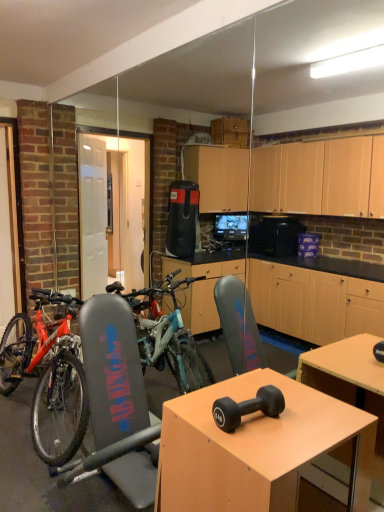
I want to click on black rubber dumbbell at center, so click(x=247, y=407).

Can you confirm if matte wood desk at center is bigger than black rubber dumbbell at center?

Indeed, matte wood desk at center has a larger size compared to black rubber dumbbell at center.

Based on the photo, from the image's perspective, is matte wood desk at center on black rubber dumbbell at center?

No.

How different are the orientations of matte wood desk at center and black rubber dumbbell at center in degrees?

The angular difference between matte wood desk at center and black rubber dumbbell at center is 1.64 degrees.

From a real-world perspective, is matte wood desk at center physically above black rubber dumbbell at center?

No, from a real-world perspective, matte wood desk at center is not above black rubber dumbbell at center.

Who is taller, shiny metallic bicycle at left or matte wood desk at center?

With more height is shiny metallic bicycle at left.

At what (x,y) coordinates should I click in order to perform the action: click on bicycle to the left of matte wood desk at center. Please return your answer as a coordinate pair (x, y). Looking at the image, I should click on (60, 405).

Consider the image. Is matte wood desk at center at the back of shiny metallic bicycle at left?

No, matte wood desk at center is not at the back of shiny metallic bicycle at left.

How different are the orientations of shiny metallic bicycle at left and matte wood desk at center in degrees?

There is a 2.19-degree angle between the facing directions of shiny metallic bicycle at left and matte wood desk at center.

Is shiny metallic bicycle at left bigger than black rubber dumbbell at center?

Yes, shiny metallic bicycle at left is bigger than black rubber dumbbell at center.

Based on the photo, from the image's perspective, between shiny metallic bicycle at left and black rubber dumbbell at center, which one is located above?

black rubber dumbbell at center, from the image's perspective.

Is shiny metallic bicycle at left wider or thinner than black rubber dumbbell at center?

shiny metallic bicycle at left is wider than black rubber dumbbell at center.

Which of these two, shiny metallic bicycle at left or black rubber dumbbell at center, stands shorter?

black rubber dumbbell at center is shorter.

Between black rubber dumbbell at center and matte wood desk at center, which one appears on the right side from the viewer's perspective?

matte wood desk at center is more to the right.

Which object is further away from the camera taking this photo, black rubber dumbbell at center or matte wood desk at center?

black rubber dumbbell at center is more distant.

Considering the relative sizes of black rubber dumbbell at center and matte wood desk at center in the image provided, is black rubber dumbbell at center thinner than matte wood desk at center?

Yes.

You are a GUI agent. You are given a task and a screenshot of the screen. Output one action in this format:
    pyautogui.click(x=<x>, y=<y>)
    Task: Click on the desk that appears above the shiny metallic bicycle at left (from a real-world perspective)
    
    Given the screenshot: What is the action you would take?
    pyautogui.click(x=256, y=448)

Does point (362, 466) appear closer or farther from the camera than point (36, 447)?

Point (362, 466) is positioned closer to the camera compared to point (36, 447).

Are matte wood desk at center and shiny metallic bicycle at left making contact?

There is a gap between matte wood desk at center and shiny metallic bicycle at left.

Looking at the image, does matte wood desk at center seem bigger or smaller compared to shiny metallic bicycle at left?

matte wood desk at center is smaller than shiny metallic bicycle at left.

Between black rubber dumbbell at center and shiny metallic bicycle at left, which one appears on the left side from the viewer's perspective?

Positioned to the left is shiny metallic bicycle at left.

Based on the photo, is black rubber dumbbell at center looking in the opposite direction of shiny metallic bicycle at left?

No, black rubber dumbbell at center is not facing away from shiny metallic bicycle at left.

Considering the relative sizes of black rubber dumbbell at center and shiny metallic bicycle at left in the image provided, is black rubber dumbbell at center shorter than shiny metallic bicycle at left?

Yes.

Where is `desk in front of the black rubber dumbbell at center`? The width and height of the screenshot is (384, 512). desk in front of the black rubber dumbbell at center is located at coordinates (256, 448).

Locate an element on the screen. The image size is (384, 512). bicycle behind the matte wood desk at center is located at coordinates (60, 405).

Looking at the image, which one is located further to black rubber dumbbell at center, matte wood desk at center or shiny metallic bicycle at left?

shiny metallic bicycle at left.

Estimate the real-world distances between objects in this image. Which object is further from matte wood desk at center, shiny metallic bicycle at left or black rubber dumbbell at center?

shiny metallic bicycle at left.

From the image, which object appears to be nearer to black rubber dumbbell at center, shiny metallic bicycle at left or matte wood desk at center?

matte wood desk at center lies closer to black rubber dumbbell at center than the other object.

Looking at the image, which one is located closer to shiny metallic bicycle at left, matte wood desk at center or black rubber dumbbell at center?

matte wood desk at center is closer to shiny metallic bicycle at left.

Looking at the image, which one is located further to matte wood desk at center, black rubber dumbbell at center or shiny metallic bicycle at left?

shiny metallic bicycle at left lies further to matte wood desk at center than the other object.

Based on their spatial positions, is black rubber dumbbell at center or matte wood desk at center further from shiny metallic bicycle at left?

The object further to shiny metallic bicycle at left is black rubber dumbbell at center.

This screenshot has height=512, width=384. Find the location of `dumbbell between shiny metallic bicycle at left and matte wood desk at center`. dumbbell between shiny metallic bicycle at left and matte wood desk at center is located at coordinates (247, 407).